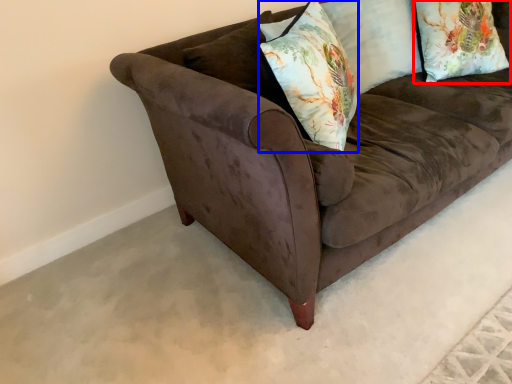
Question: Which of the following is the closest to the observer, pillow (highlighted by a red box) or throw pillow (highlighted by a blue box)?

Choices:
 (A) pillow
 (B) throw pillow

Answer: (B)